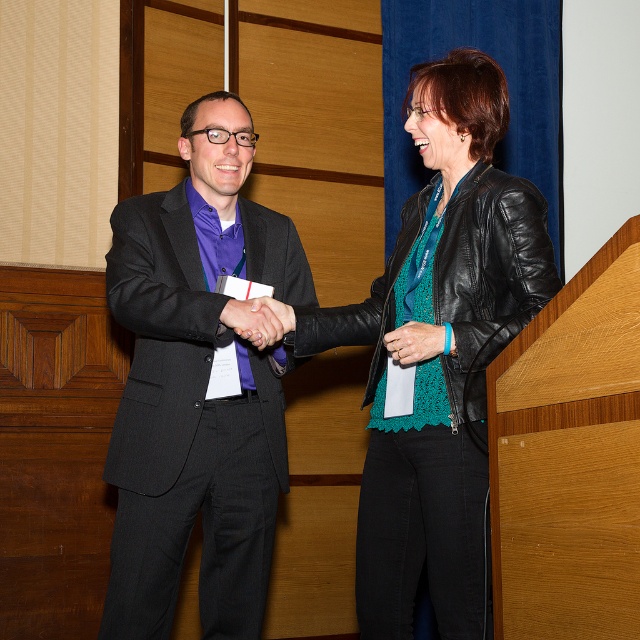
Between black leather jacket at center and matte black hand at center, which one has more height?

black leather jacket at center is taller.

Can you confirm if black leather jacket at center is thinner than matte black hand at center?

No, black leather jacket at center is not thinner than matte black hand at center.

Where is `black leather jacket at center`? The height and width of the screenshot is (640, 640). black leather jacket at center is located at coordinates (442, 353).

Between black leather jacket at center and matte black leather at center, which one appears on the right side from the viewer's perspective?

Positioned to the right is black leather jacket at center.

Does point (428, 396) come behind point (419, 323)?

Yes, point (428, 396) is farther from viewer.

At what (x,y) coordinates should I click in order to perform the action: click on black leather jacket at center. Please return your answer as a coordinate pair (x, y). The width and height of the screenshot is (640, 640). Looking at the image, I should click on (442, 353).

Does matte black suit at center have a smaller size compared to matte black hand at center?

Incorrect, matte black suit at center is not smaller in size than matte black hand at center.

Is point (212, 298) more distant than point (273, 320)?

No, it is not.

The width and height of the screenshot is (640, 640). What are the coordinates of `matte black suit at center` in the screenshot? It's located at (196, 388).